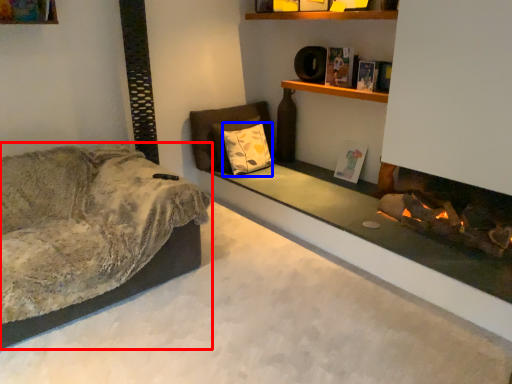
Question: Which object appears farthest to the camera in this image, studio couch (highlighted by a red box) or pillow (highlighted by a blue box)?

Choices:
 (A) studio couch
 (B) pillow

Answer: (B)